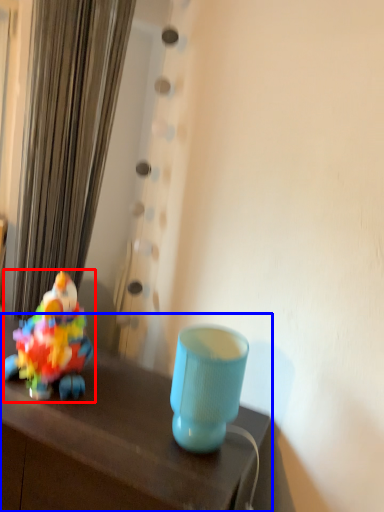
Question: Which point is further to the camera, toy (highlighted by a red box) or table (highlighted by a blue box)?

Choices:
 (A) toy
 (B) table

Answer: (A)